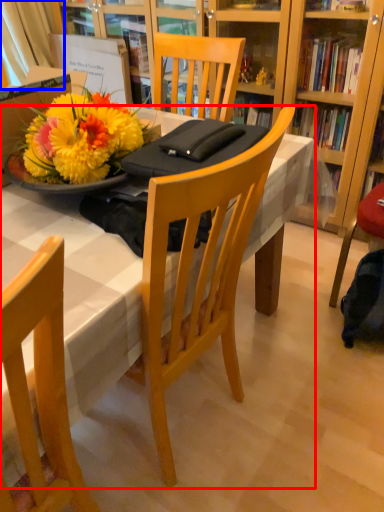
Question: Which point is further to the camera, desk (highlighted by a red box) or curtain (highlighted by a blue box)?

Choices:
 (A) desk
 (B) curtain

Answer: (B)